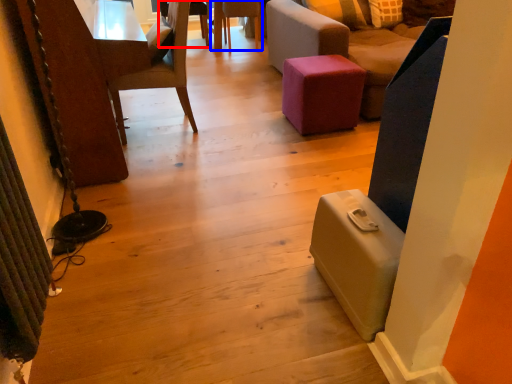
Question: Which object is further to the camera taking this photo, chair (highlighted by a red box) or chair (highlighted by a blue box)?

Choices:
 (A) chair
 (B) chair

Answer: (A)